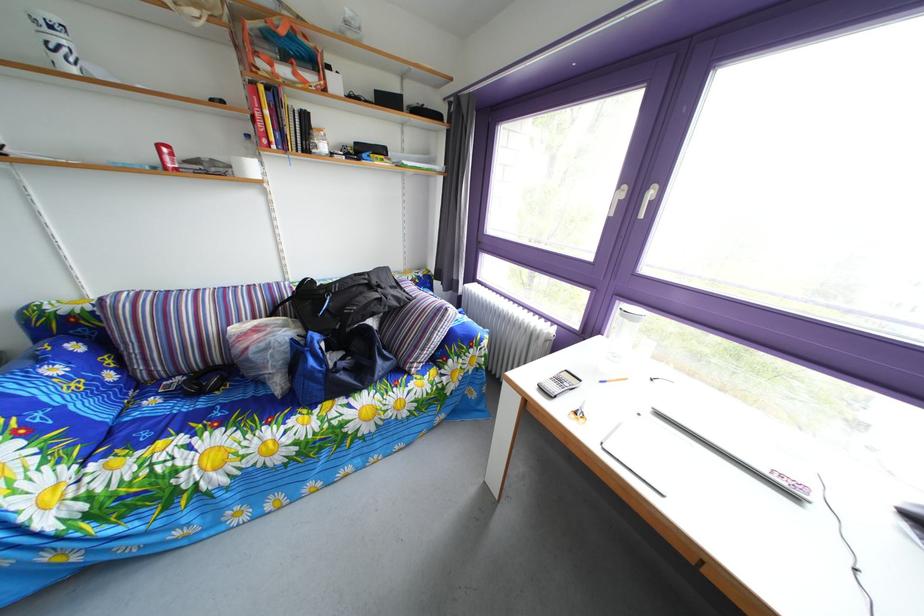
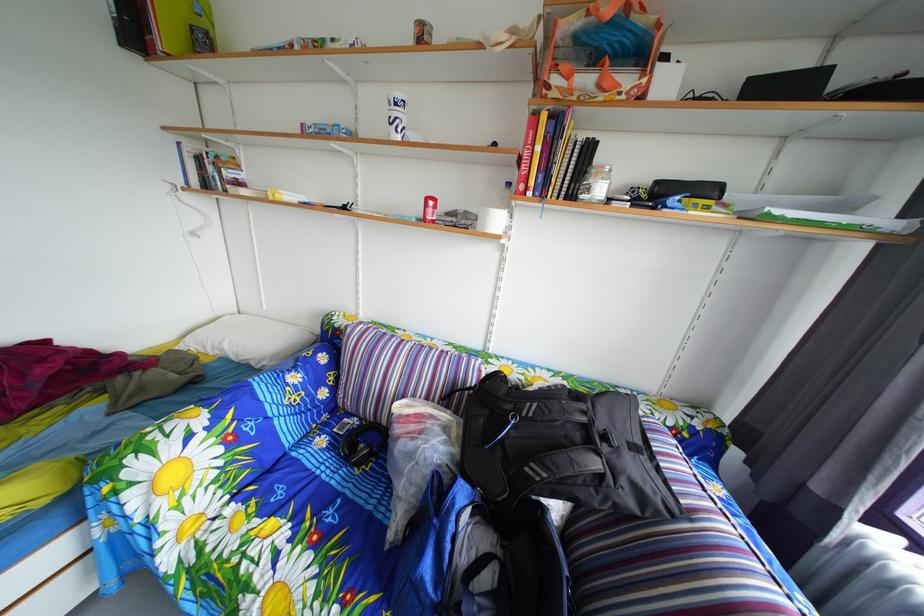
Find the pixel in the second image that matches (189,387) in the first image.

(367, 428)